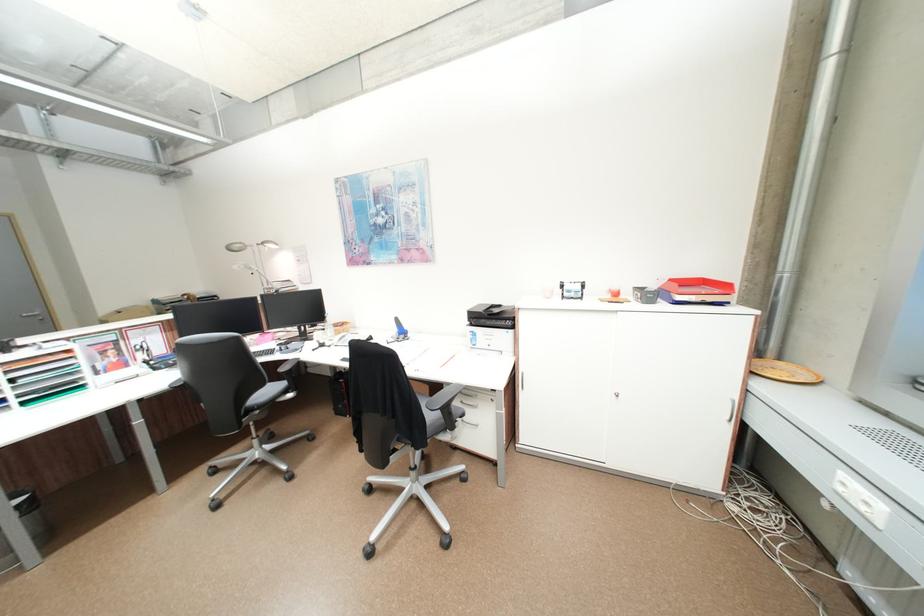
You are a GUI agent. You are given a task and a screenshot of the screen. Output one action in this format:
    pyautogui.click(x=<x>, y=<y>)
    Task: Click on the black chair armrest
    
    Given the screenshot: What is the action you would take?
    pyautogui.click(x=444, y=398)